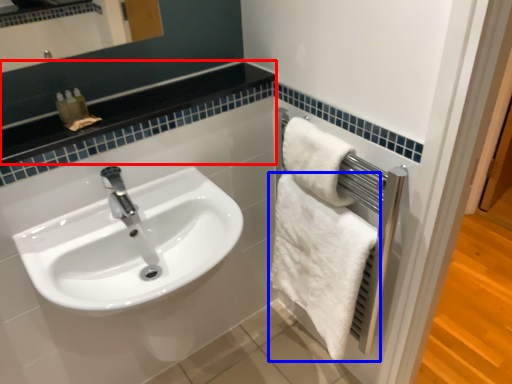
Question: Which object is further to the camera taking this photo, balustrade (highlighted by a red box) or towel (highlighted by a blue box)?

Choices:
 (A) balustrade
 (B) towel

Answer: (B)